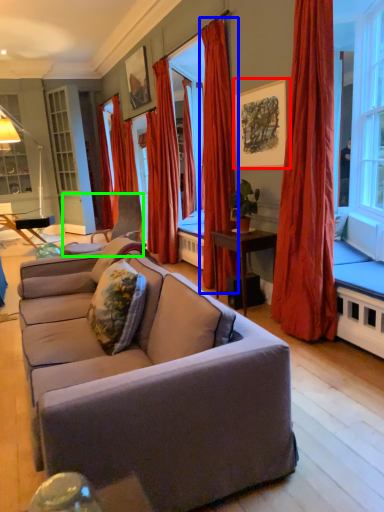
Question: Which object is positioned farthest from picture frame (highlighted by a red box)? Select from curtain (highlighted by a blue box) and chair (highlighted by a green box).

Choices:
 (A) curtain
 (B) chair

Answer: (B)